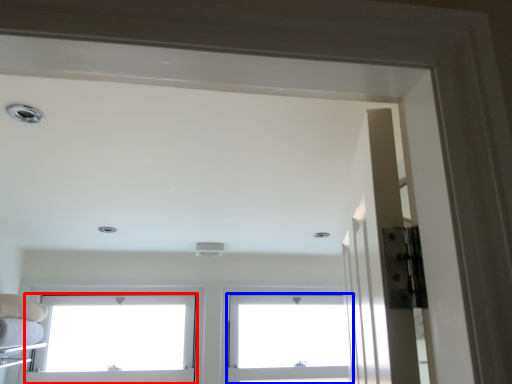
Question: Which object is closer to the camera taking this photo, window (highlighted by a red box) or window (highlighted by a blue box)?

Choices:
 (A) window
 (B) window

Answer: (A)